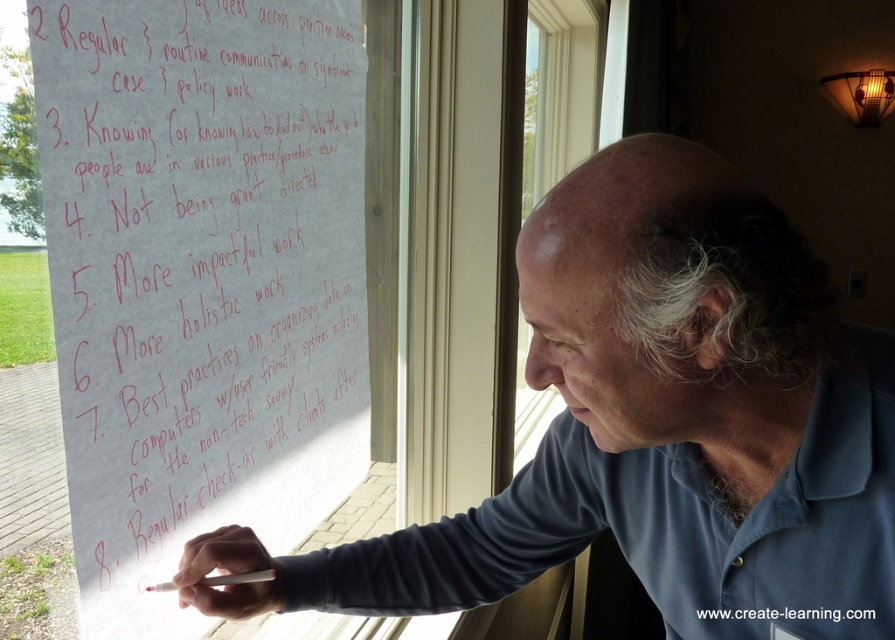
What do you see at coordinates (653, 424) in the screenshot?
I see `blue cotton shirt at center` at bounding box center [653, 424].

Which is more to the left, blue cotton shirt at center or white matte cigarette at lower center?

white matte cigarette at lower center is more to the left.

Does point (771, 540) lie in front of point (236, 576)?

Yes, point (771, 540) is in front of point (236, 576).

The image size is (895, 640). Find the location of `blue cotton shirt at center`. blue cotton shirt at center is located at coordinates (653, 424).

Measure the distance from blue cotton shirt at center to clear glass window at center.

blue cotton shirt at center is 6.65 feet from clear glass window at center.

The height and width of the screenshot is (640, 895). What do you see at coordinates (653, 424) in the screenshot?
I see `blue cotton shirt at center` at bounding box center [653, 424].

Where is `blue cotton shirt at center`? This screenshot has height=640, width=895. blue cotton shirt at center is located at coordinates (653, 424).

Is white handwritten paper at upper left thinner than clear glass window at center?

Yes, white handwritten paper at upper left is thinner than clear glass window at center.

You are a GUI agent. You are given a task and a screenshot of the screen. Output one action in this format:
    pyautogui.click(x=<x>, y=<y>)
    Task: Click on the white handwritten paper at upper left
    This screenshot has height=640, width=895.
    Given the screenshot: What is the action you would take?
    pyautogui.click(x=200, y=278)